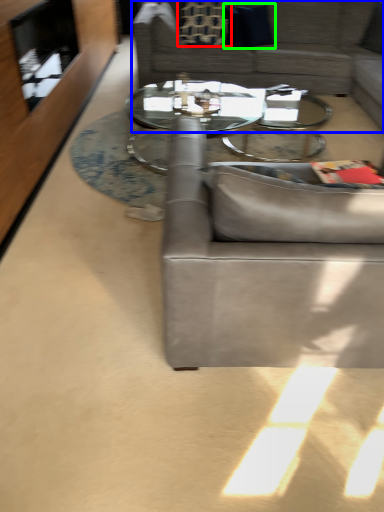
Question: Considering the real-world distances, which object is closest to pillow (highlighted by a red box)? studio couch (highlighted by a blue box) or pillow (highlighted by a green box).

Choices:
 (A) studio couch
 (B) pillow

Answer: (B)